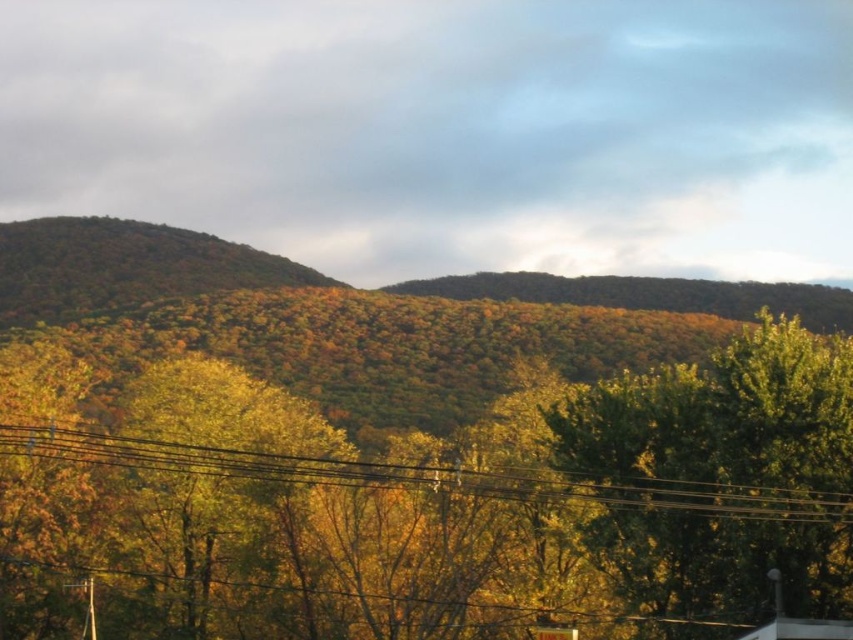
Can you confirm if yellow-green foliage at center is taller than metallic wires at lower center?

Yes, yellow-green foliage at center is taller than metallic wires at lower center.

Is point (804, 356) less distant than point (122, 456)?

No, (804, 356) is behind (122, 456).

Is point (163, 556) more distant than point (431, 472)?

Yes, it is.

The width and height of the screenshot is (853, 640). Identify the location of yellow-green foliage at center. (426, 502).